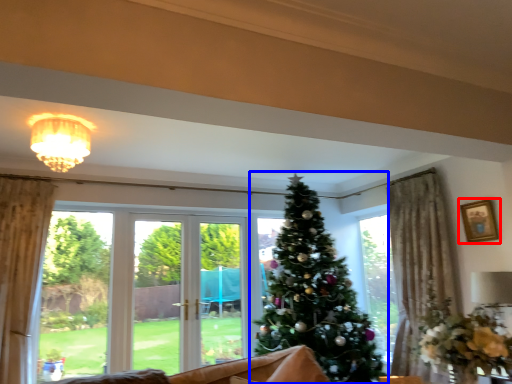
Question: Among these objects, which one is nearest to the camera, picture frame (highlighted by a red box) or christmas tree (highlighted by a blue box)?

Choices:
 (A) picture frame
 (B) christmas tree

Answer: (B)